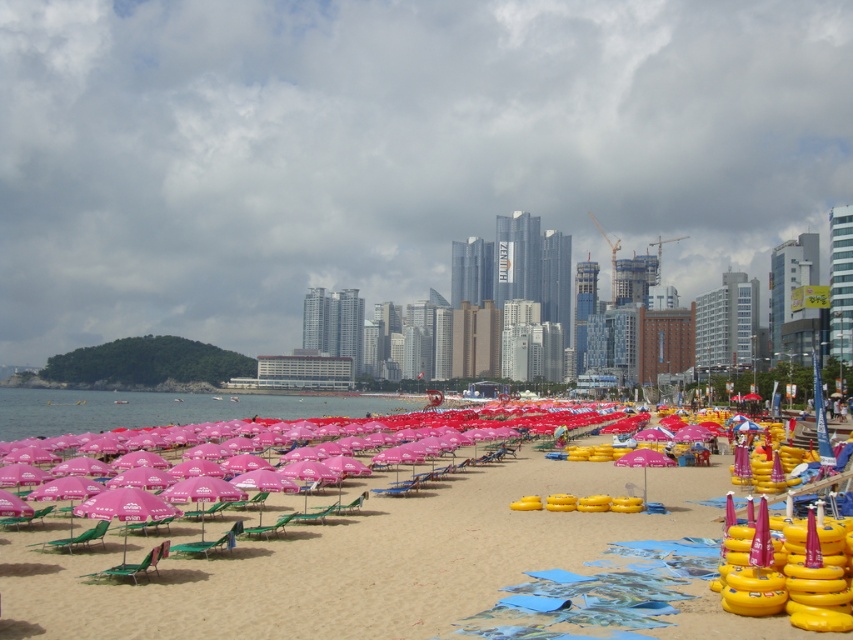
The width and height of the screenshot is (853, 640). I want to click on sandy beach at center, so click(x=360, y=560).

Can you confirm if sandy beach at center is bigger than transparent water at center?

No.

Does point (354, 570) lie in front of point (163, 413)?

Yes, point (354, 570) is in front of point (163, 413).

What are the coordinates of `sandy beach at center` in the screenshot? It's located at (360, 560).